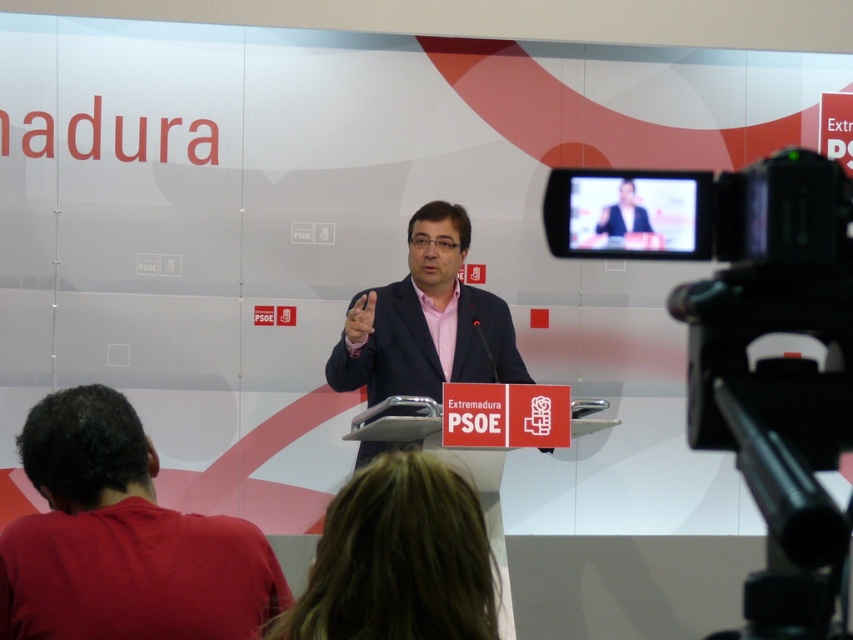
You are a photographer at the event. You need to position your camera to capture the speaker and the PSOE logo on the wall. The camera is at point (776,372). Can you see both the speaker and the PSOE logo from this position?

The black plastic video camera at right is represented by point (776,372). Since the speaker is at the podium facing the audience and the PSOE logo is on the backdrop wall behind him, the camera should have a clear view of both the speaker and the logo from that position.

You are a photographer at the event and need to position yourself so that the matte black suit at center is framed to the left of the black plastic video camera at right in your shot. Is this possible given their current positions?

The black plastic video camera at right is to the right of the matte black suit at center, so yes, you can frame the matte black suit at center to the left of the black plastic video camera at right in your shot since their current positions already have the camera on the right side of the suit.

You are a photographer at the event and need to capture a photo that includes both the black plastic video camera at right and the dark red shirt at lower left. What is the minimum distance you need to move your camera backward to ensure both objects are in frame?

The black plastic video camera at right and dark red shirt at lower left are 39.23 inches apart. To include both in the frame, you must position your camera at least 39.23 inches away from the closer object.